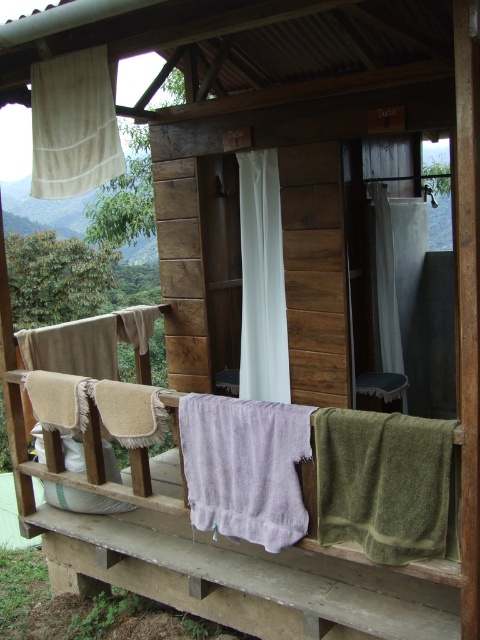
Which is more to the right, lavender terry towel at center or beige fabric curtain at upper left?

From the viewer's perspective, lavender terry towel at center appears more on the right side.

Between lavender terry towel at center and beige fabric curtain at upper left, which one is positioned higher?

beige fabric curtain at upper left

At what (x,y) coordinates should I click in order to perform the action: click on lavender terry towel at center. Please return your answer as a coordinate pair (x, y). The image size is (480, 640). Looking at the image, I should click on (244, 467).

Does lavender terry towel at center have a greater width compared to white fabric curtain at center?

Indeed, lavender terry towel at center has a greater width compared to white fabric curtain at center.

Which is more to the right, lavender terry towel at center or white fabric curtain at center?

From the viewer's perspective, white fabric curtain at center appears more on the right side.

This screenshot has width=480, height=640. In order to click on lavender terry towel at center in this screenshot , I will do `click(244, 467)`.

In order to click on lavender terry towel at center in this screenshot , I will do `click(244, 467)`.

This screenshot has width=480, height=640. Describe the element at coordinates (73, 124) in the screenshot. I see `beige fabric curtain at upper left` at that location.

Is point (39, 156) closer to camera compared to point (267, 348)?

Yes, it is in front of point (267, 348).

Is point (66, 147) positioned in front of point (260, 340)?

Yes, point (66, 147) is closer to viewer.

This screenshot has width=480, height=640. In order to click on beige fabric curtain at upper left in this screenshot , I will do `click(73, 124)`.